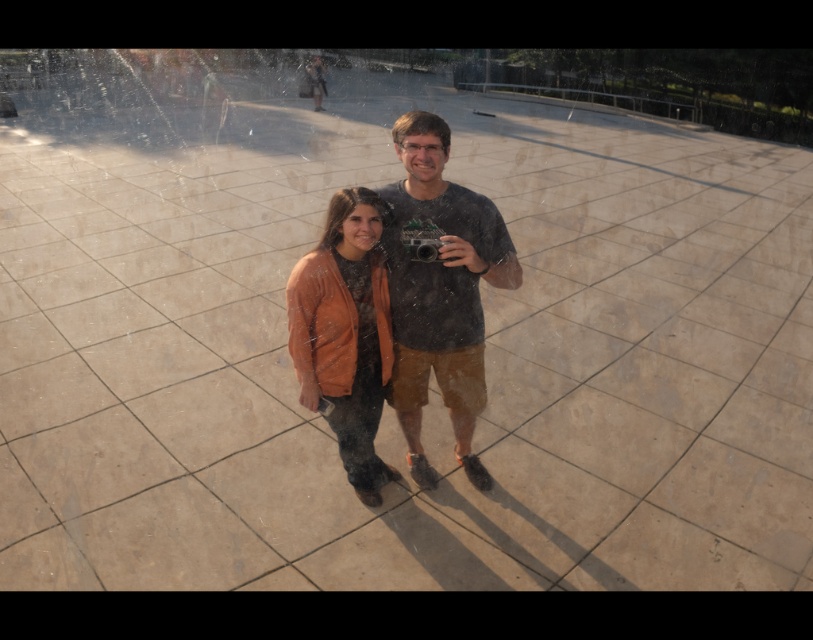
Which is above, matte black t-shirt at center or matte orange jacket at center?

matte black t-shirt at center is above.

Between point (383, 248) and point (364, 301), which one is positioned in front?

Point (364, 301) is more forward.

Find the location of `matte black t-shirt at center`. matte black t-shirt at center is located at coordinates (438, 291).